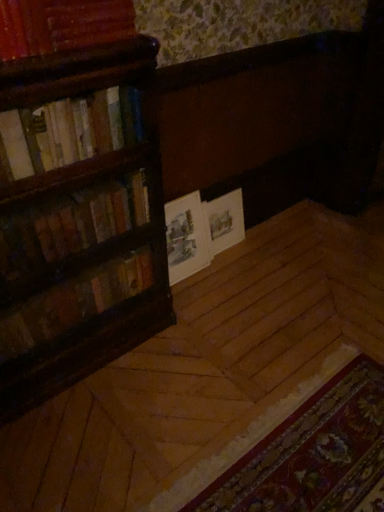
Question: In terms of width, does white paper book at center look wider or thinner when compared to wooden bookshelf at left, placed as the 4th book when sorted from top to bottom?

Choices:
 (A) thin
 (B) wide

Answer: (A)

Question: Considering their positions, is white paper book at center located in front of or behind wooden bookshelf at left, placed as the 4th book when sorted from top to bottom?

Choices:
 (A) front
 (B) behind

Answer: (B)

Question: Based on their relative distances, which object is farther from the hardcover books at left, arranged as the 2th book when viewed from the top?

Choices:
 (A) hardcover books at left, which is the second book in bottom-to-top order
 (B) wooden bookshelf at left, placed as the first book when sorted from bottom to top
 (C) white paper at center
 (D) white paper book at center
 (E) carpeted mat at lower right

Answer: (E)

Question: Based on their relative distances, which object is nearer to the white paper at center?

Choices:
 (A) white paper book at center
 (B) hardcover books at left, placed as the 3th book when sorted from top to bottom
 (C) wooden bookshelf at left, placed as the 4th book when sorted from top to bottom
 (D) carpeted mat at lower right
 (E) hardcover books at left, arranged as the 2th book when viewed from the top

Answer: (A)